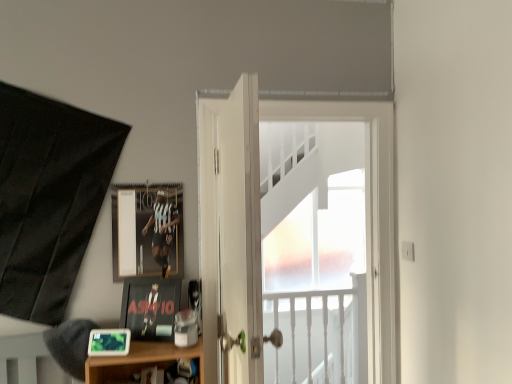
Question: Considering the relative positions of white wooden door at center, which is the 1th door from front to back, and white glossy door at center, marked as the first door in a back-to-front arrangement, in the image provided, is white wooden door at center, which is the 1th door from front to back, behind white glossy door at center, marked as the first door in a back-to-front arrangement,?

Choices:
 (A) yes
 (B) no

Answer: (B)

Question: Can you confirm if white wooden door at center, which is the 1th door from front to back, is positioned to the left of white glossy door at center, marked as the first door in a back-to-front arrangement?

Choices:
 (A) no
 (B) yes

Answer: (B)

Question: Considering the relative sizes of white wooden door at center, which is the 1th door from front to back, and white glossy door at center, marked as the first door in a back-to-front arrangement, in the image provided, is white wooden door at center, which is the 1th door from front to back, smaller than white glossy door at center, marked as the first door in a back-to-front arrangement,?

Choices:
 (A) no
 (B) yes

Answer: (A)

Question: Can you confirm if white wooden door at center, which is the 1th door from front to back, is shorter than white glossy door at center, marked as the first door in a back-to-front arrangement?

Choices:
 (A) no
 (B) yes

Answer: (B)

Question: From the image's perspective, is white wooden door at center, positioned as the 2th door in back-to-front order, located above white glossy door at center, positioned as the second door in front-to-back order?

Choices:
 (A) yes
 (B) no

Answer: (B)

Question: Looking at their shapes, would you say white frosted glass at center is wider or thinner than matte black picture frame at lower left, placed as the first picture frame when sorted from bottom to top?

Choices:
 (A) thin
 (B) wide

Answer: (B)

Question: From their relative heights in the image, would you say white frosted glass at center is taller or shorter than matte black picture frame at lower left, placed as the first picture frame when sorted from bottom to top?

Choices:
 (A) tall
 (B) short

Answer: (A)

Question: Which is correct: white frosted glass at center is inside matte black picture frame at lower left, which is the 1th picture frame from front to back, or outside of it?

Choices:
 (A) inside
 (B) outside

Answer: (B)

Question: Would you say white frosted glass at center is to the left or to the right of matte black picture frame at lower left, the third picture frame from the back, in the picture?

Choices:
 (A) right
 (B) left

Answer: (A)

Question: In terms of height, does white glossy door at center, marked as the first door in a back-to-front arrangement, look taller or shorter compared to matte black picture frame at lower left, marked as the 2th picture frame in a back-to-front arrangement?

Choices:
 (A) tall
 (B) short

Answer: (A)

Question: From the image's perspective, is white glossy door at center, marked as the first door in a back-to-front arrangement, positioned above or below matte black picture frame at lower left, the second picture frame viewed from the front?

Choices:
 (A) above
 (B) below

Answer: (A)

Question: Is white glossy door at center, marked as the first door in a back-to-front arrangement, inside the boundaries of matte black picture frame at lower left, which is the second picture frame from bottom to top, or outside?

Choices:
 (A) outside
 (B) inside

Answer: (A)

Question: Is white glossy door at center, positioned as the second door in front-to-back order, in front of or behind matte black picture frame at lower left, the second picture frame viewed from the front, in the image?

Choices:
 (A) front
 (B) behind

Answer: (B)

Question: Considering the positions of white wooden door at center, which is the 1th door from front to back, and white glossy door at center, marked as the first door in a back-to-front arrangement, in the image, is white wooden door at center, which is the 1th door from front to back, taller or shorter than white glossy door at center, marked as the first door in a back-to-front arrangement,?

Choices:
 (A) short
 (B) tall

Answer: (A)

Question: From a real-world perspective, relative to white glossy door at center, positioned as the second door in front-to-back order, is white wooden door at center, which is the 1th door from front to back, vertically above or below?

Choices:
 (A) above
 (B) below

Answer: (B)